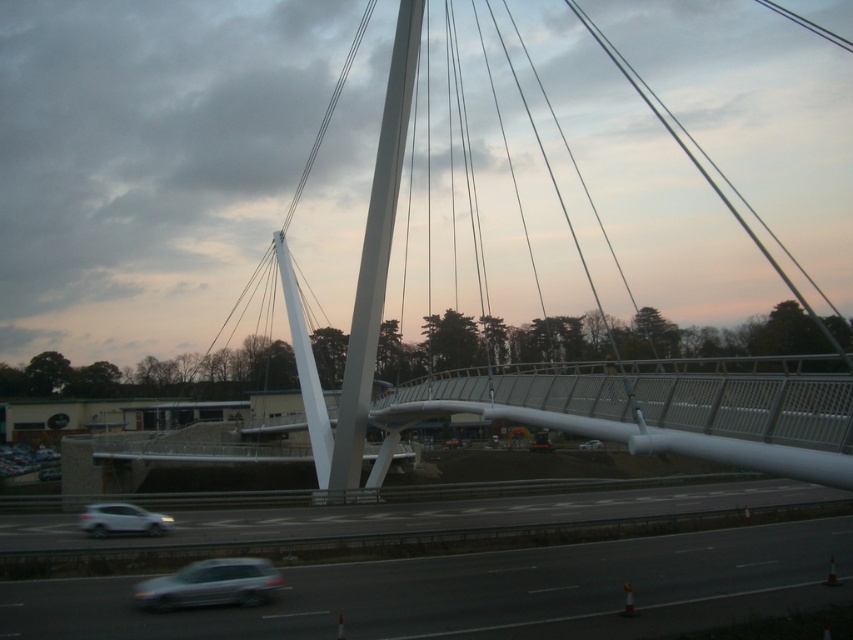
Looking at this image, can you confirm if white glossy car at lower left is taller than silver metallic car at center?

No.

Is white glossy car at lower left to the left of silver metallic car at center from the viewer's perspective?

Yes, white glossy car at lower left is to the left of silver metallic car at center.

Is point (103, 529) positioned in front of point (598, 440)?

No.

Where is `white glossy car at lower left`? The height and width of the screenshot is (640, 853). white glossy car at lower left is located at coordinates (120, 518).

In order to click on satin silver car at lower center in this screenshot , I will do `click(210, 584)`.

Which is more to the left, satin silver car at lower center or white glossy car at lower left?

Positioned to the left is white glossy car at lower left.

Locate an element on the screen. satin silver car at lower center is located at coordinates (210, 584).

How far apart are smooth asphalt highway at lower center and silver metallic car at center?

A distance of 9.68 meters exists between smooth asphalt highway at lower center and silver metallic car at center.

Measure the distance between smooth asphalt highway at lower center and camera.

The distance of smooth asphalt highway at lower center from camera is 15.30 meters.

You are a GUI agent. You are given a task and a screenshot of the screen. Output one action in this format:
    pyautogui.click(x=<x>, y=<y>)
    Task: Click on the smooth asphalt highway at lower center
    This screenshot has width=853, height=640.
    Given the screenshot: What is the action you would take?
    pyautogui.click(x=485, y=592)